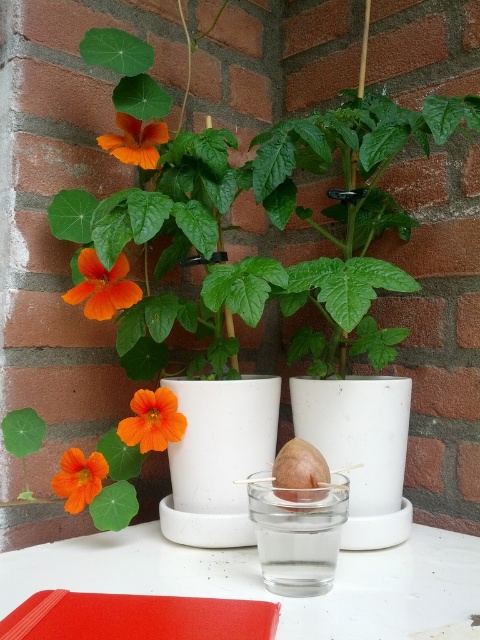
Does white glossy table at lower center have a greater width compared to orange matte flower at left?

Indeed, white glossy table at lower center has a greater width compared to orange matte flower at left.

Who is more distant from viewer, (97, 580) or (120, 266)?

Positioned behind is point (120, 266).

Identify the location of white glossy table at lower center. (264, 586).

This screenshot has height=640, width=480. Identify the location of orange matte flower at left. (103, 285).

Measure the distance between orange matte flower at left and orange matte flower at lower left.

9.39 inches

Image resolution: width=480 pixels, height=640 pixels. What are the coordinates of `orange matte flower at left` in the screenshot? It's located at (103, 285).

Between white glossy table at lower center and orange matte flower at lower left, which one is positioned higher?

orange matte flower at lower left is above.

Who is taller, white glossy table at lower center or orange matte flower at lower left?

Standing taller between the two is orange matte flower at lower left.

Is point (153, 538) positioned behind point (73, 468)?

Yes, point (153, 538) is farther from viewer.

Where is `white glossy table at lower center`? The height and width of the screenshot is (640, 480). white glossy table at lower center is located at coordinates (264, 586).